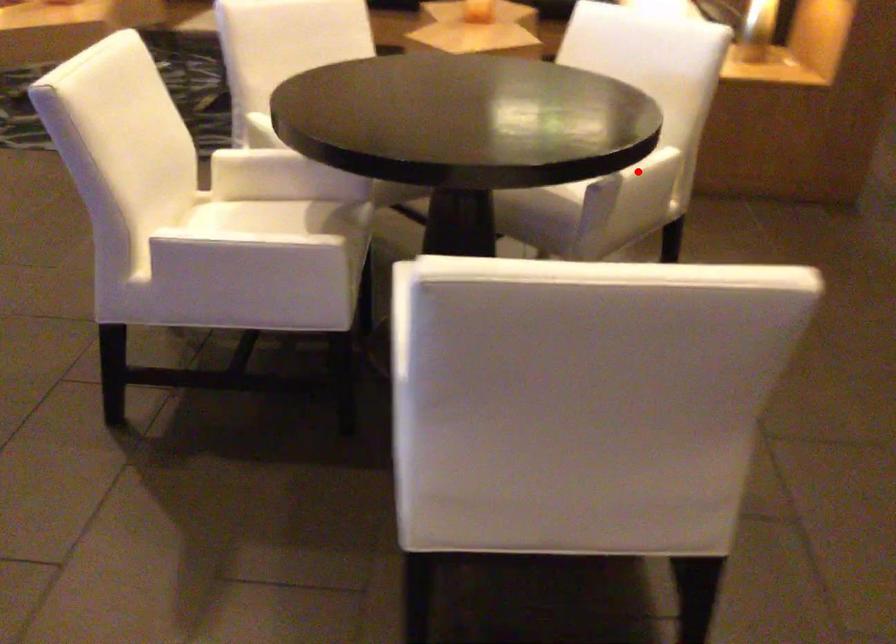
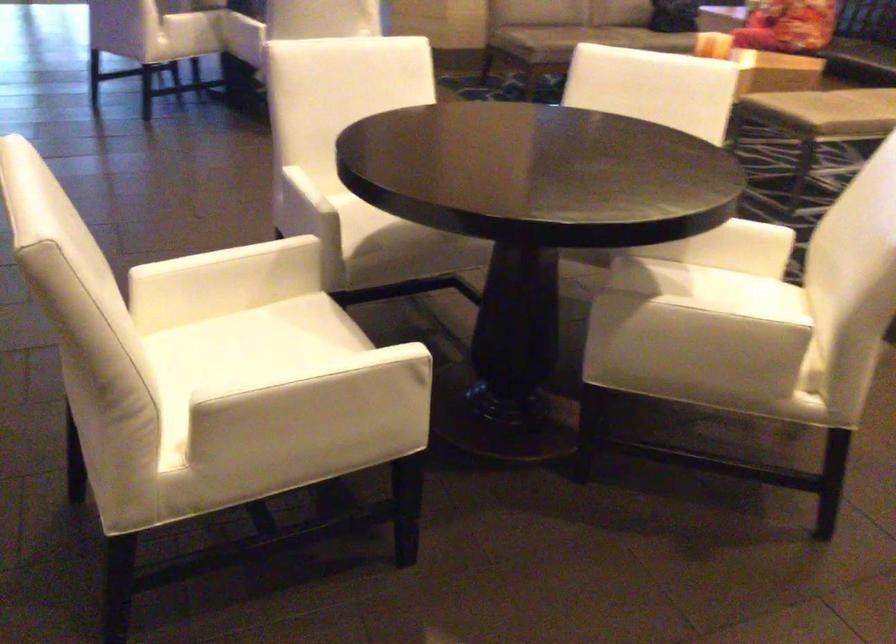
Question: I am providing you with two images of the same scene from different viewpoints. Given a red point in image1, look at the same physical point in image2. Is it:

Choices:
 (A) Closer to the viewpoint
 (B) Farther from the viewpoint

Answer: (A)